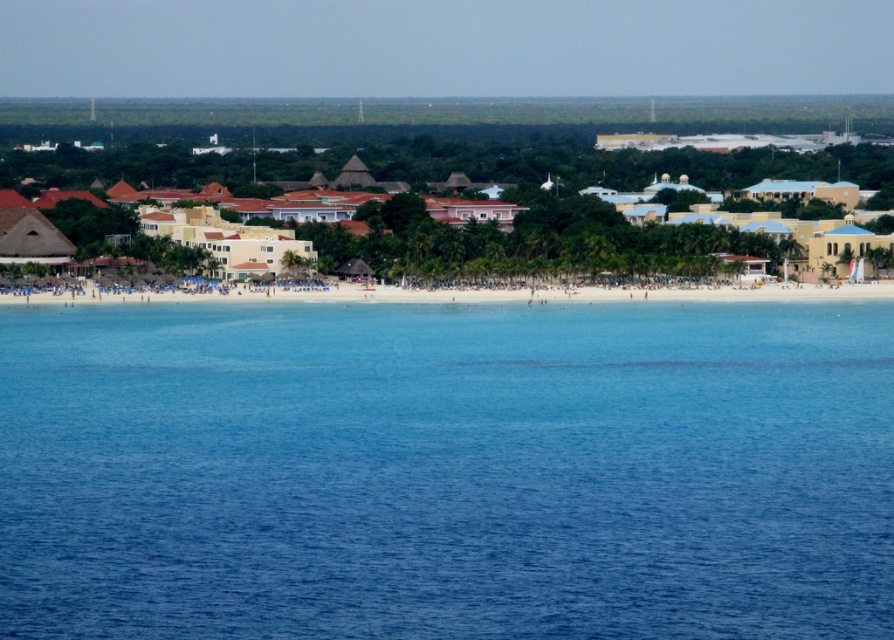
Is clear blue water at center to the left of white sandy beach at center from the viewer's perspective?

Incorrect, clear blue water at center is not on the left side of white sandy beach at center.

Is clear blue water at center smaller than white sandy beach at center?

No.

Between point (621, 378) and point (342, 284), which one is positioned in front?

Point (621, 378) is in front.

The image size is (894, 640). I want to click on clear blue water at center, so click(447, 470).

Does clear blue water at center appear under yellow matte building at center?

Yes, clear blue water at center is below yellow matte building at center.

Which is in front, point (670, 632) or point (521, 244)?

Point (670, 632)

Locate an element on the screen. The width and height of the screenshot is (894, 640). clear blue water at center is located at coordinates (447, 470).

Is point (515, 237) positioned after point (529, 294)?

Yes, it is.

At what (x,y) coordinates should I click in order to perform the action: click on yellow matte building at center. Please return your answer as a coordinate pair (x, y). Looking at the image, I should click on (525, 237).